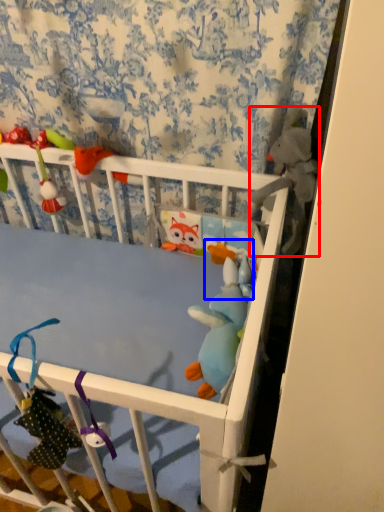
Question: Which point is further to the camera, toy (highlighted by a red box) or toy (highlighted by a blue box)?

Choices:
 (A) toy
 (B) toy

Answer: (B)